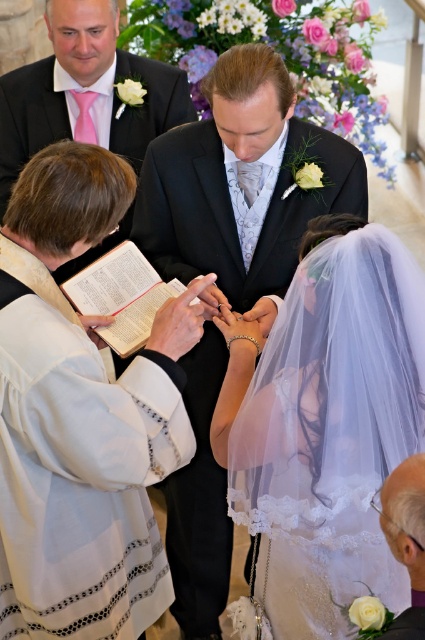
You are a photographer at a wedding. You need to capture a closeup shot of the white lace veil at center and the black satin suit at center. Since the veil is smaller, how should you adjust your camera focus to ensure both are in focus?

The white lace veil at center has a smaller size compared to black satin suit at center. To ensure both are in focus, you should focus on the black satin suit at center first since it is larger and then adjust the focus to include the smaller white lace veil at center within the depth of field.

From the picture: You are a photographer at a wedding and want to capture a shot of the white lace veil at center and the matte pink tie at upper left. Which object is located more to the right in the frame?

The white lace veil at center is positioned on the right side of the matte pink tie at upper left, so it is more to the right in the frame.

You are a photographer at a wedding. You need to capture a photo where both the white lace veil at center and the matte pink tie at upper left are clearly visible. Considering their sizes, which object might require you to adjust your camera angle to ensure it is fully in frame?

The white lace veil at center is much taller than the matte pink tie at upper left, so you might need to adjust your camera angle to ensure the taller white lace veil at center is fully in frame.